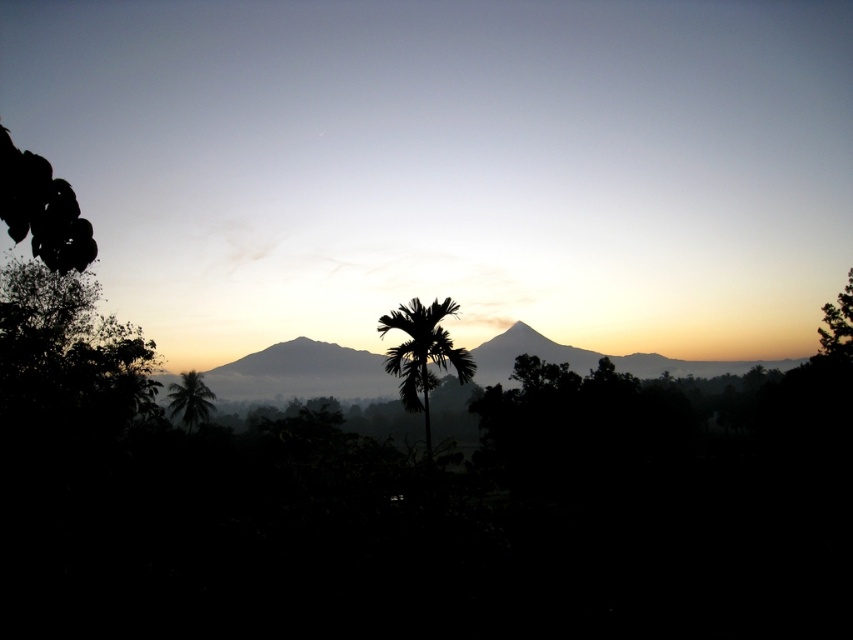
You are an observer standing in the middle of the scene. You see the green leafy tree at left and the green leafy tree at right. Which tree appears closer to the ground?

The green leafy tree at left is located below the green leafy tree at right, so it appears closer to the ground.